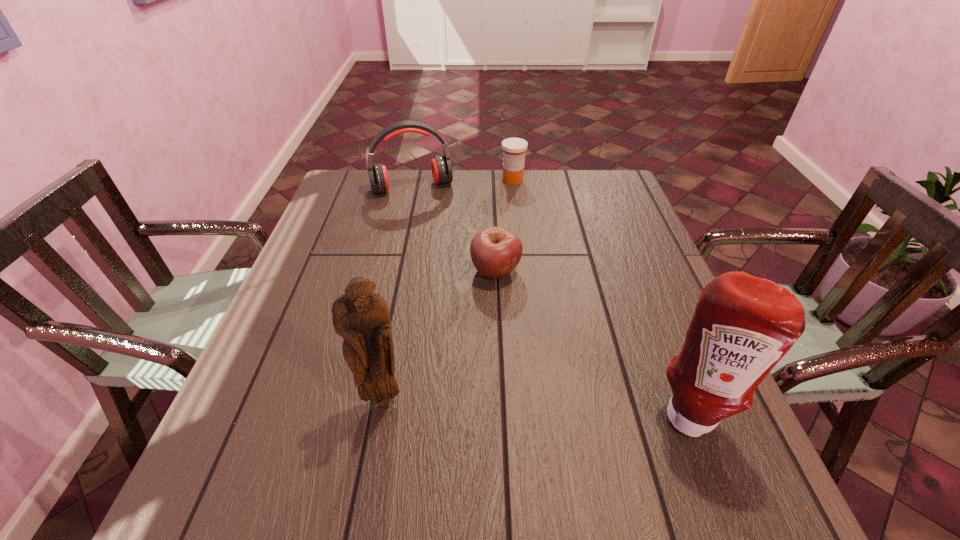
The width and height of the screenshot is (960, 540). I want to click on vacant area between the condiment and the fourth tallest object, so click(601, 296).

At what (x,y) coordinates should I click in order to perform the action: click on the third closest object to the second shortest object. Please return your answer as a coordinate pair (x, y). Looking at the image, I should click on [743, 325].

The width and height of the screenshot is (960, 540). Find the location of `object that is the nearest to the figurine`. object that is the nearest to the figurine is located at coordinates (495, 252).

In order to click on free space that satisfies the following two spatial constraints: 1. on the front-facing side of the figurine; 2. on the right side of the condiment in this screenshot , I will do `click(380, 413)`.

I want to click on vacant area that satisfies the following two spatial constraints: 1. on the front-facing side of the figurine; 2. on the right side of the condiment, so click(380, 413).